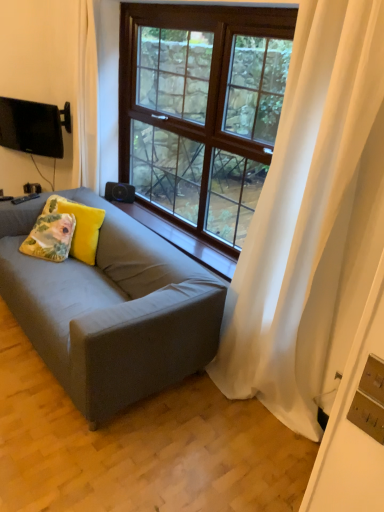
Question: In the image, is floral fabric pillow at left, the 2th pillow when ordered from right to left, positioned in front of or behind wooden at center?

Choices:
 (A) front
 (B) behind

Answer: (B)

Question: Is point (61, 229) positioned closer to the camera than point (213, 261)?

Choices:
 (A) farther
 (B) closer

Answer: (A)

Question: Which object is positioned farthest from the matte black tv at upper left?

Choices:
 (A) floral fabric cushion at center, the first pillow in the right-to-left sequence
 (B) matte gray couch at center
 (C) brown wooden window at center
 (D) floral fabric pillow at left, the 2th pillow when ordered from right to left
 (E) white sheer curtain at right

Answer: (E)

Question: Estimate the real-world distances between objects in this image. Which object is farther from the floral fabric pillow at left, the 2th pillow when ordered from right to left?

Choices:
 (A) matte gray couch at center
 (B) brown wooden window at center
 (C) floral fabric cushion at center, which ranks as the 2th pillow in left-to-right order
 (D) wooden at center
 (E) matte black tv at upper left

Answer: (B)